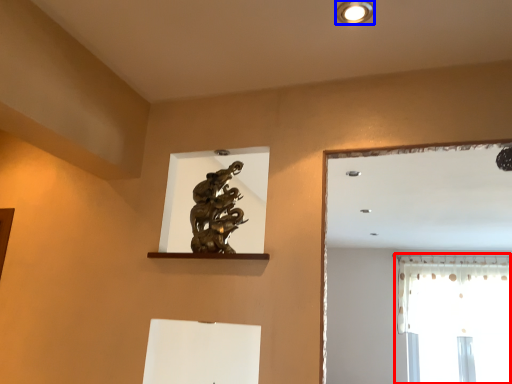
Question: Which object is closer to the camera taking this photo, window (highlighted by a red box) or lighting (highlighted by a blue box)?

Choices:
 (A) window
 (B) lighting

Answer: (B)